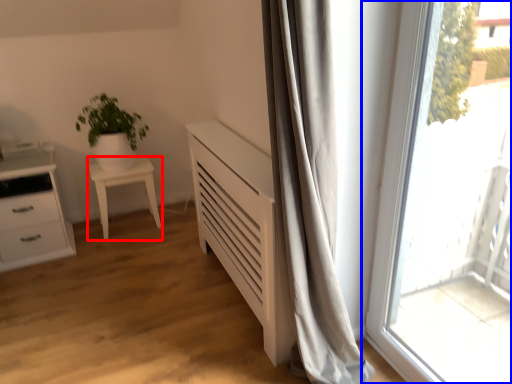
Question: Which object appears farthest to the camera in this image, furniture (highlighted by a red box) or window (highlighted by a blue box)?

Choices:
 (A) furniture
 (B) window

Answer: (A)